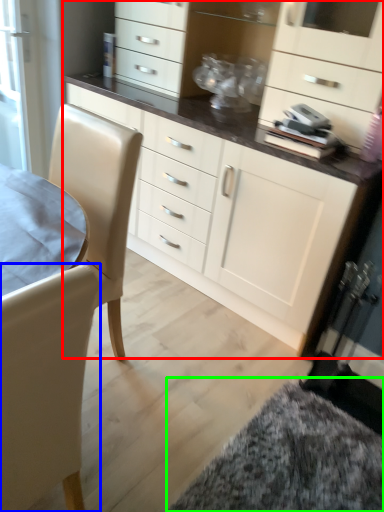
Question: Based on their relative distances, which object is farther from cabinetry (highlighted by a red box)? Choose from chair (highlighted by a blue box) and wide (highlighted by a green box).

Choices:
 (A) chair
 (B) wide

Answer: (A)